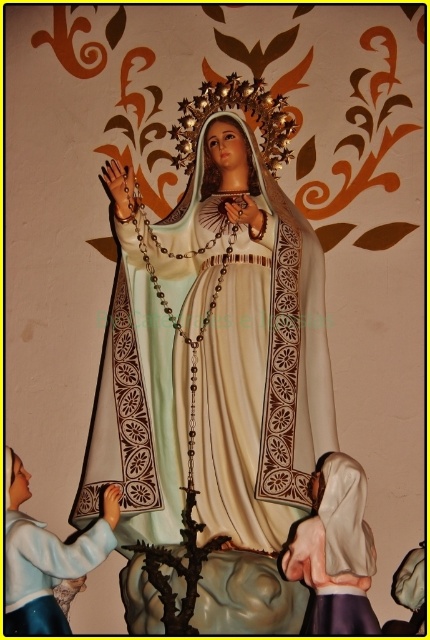
Can you confirm if matte gold statue at center is smaller than white satin robe at lower left?

No, matte gold statue at center is not smaller than white satin robe at lower left.

Can you confirm if matte gold statue at center is positioned below white satin robe at lower left?

No, matte gold statue at center is not below white satin robe at lower left.

At what (x,y) coordinates should I click in order to perform the action: click on matte gold statue at center. Please return your answer as a coordinate pair (x, y). Image resolution: width=430 pixels, height=640 pixels. Looking at the image, I should click on (254, 344).